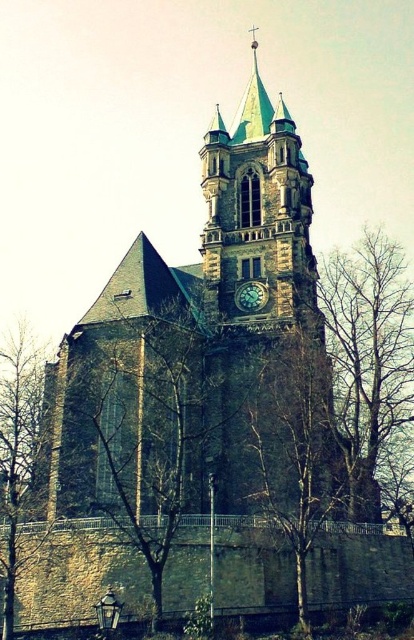
You are a bird looking for a place to perch. You see a bare wood tree at center and a green glass spire at upper center. Which one is shorter and better for landing?

The bare wood tree at center is shorter than the green glass spire at upper center, so it might be better for landing since it is lower and more accessible.

You are standing in front of the historic church and want to take a photo of both the brown textured tree at right and the gold textured clock at center. Which object should you focus on first to ensure both are in the frame?

You should focus on the brown textured tree at right first because it is closer to the viewer than the gold textured clock at center, allowing both to be in the frame when properly adjusted.

You are an artist sketching the church and notice the bare branches at left and the gold textured clock at center. Which object is located to the left of the other?

The bare branches at left is positioned on the left side of gold textured clock at center.